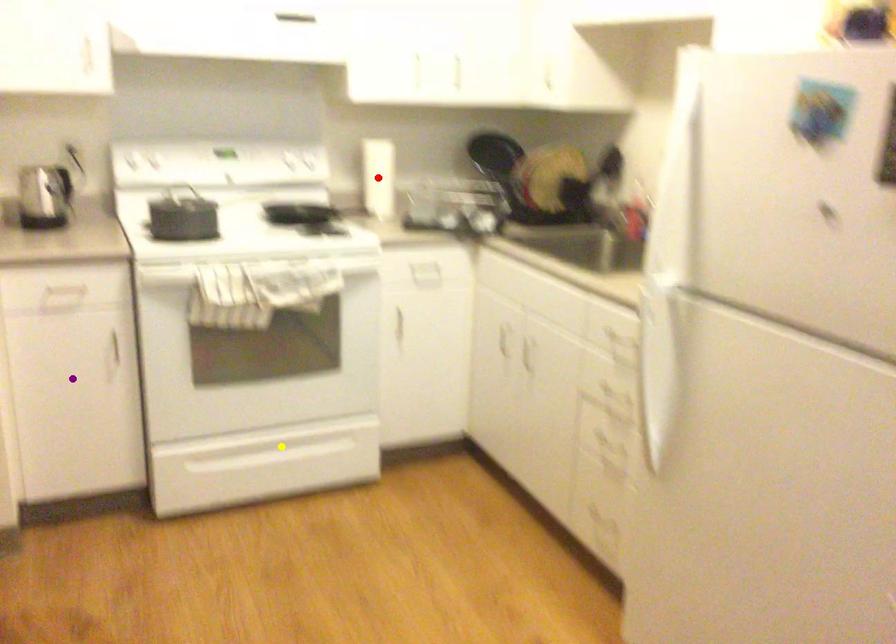
Order these from nearest to farthest:
red point
yellow point
purple point

1. purple point
2. yellow point
3. red point